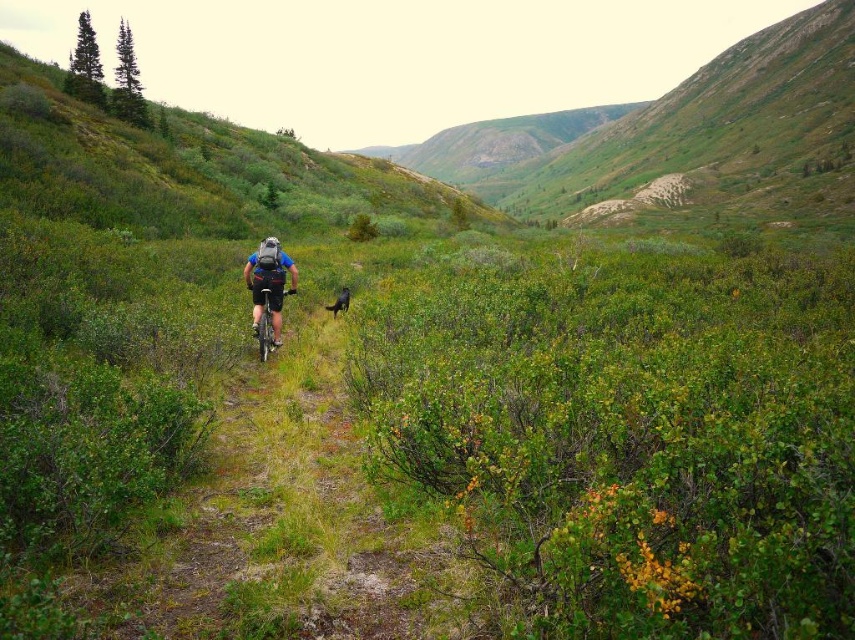
Is the position of blue matte bicycle at center more distant than that of shiny black dog at center?

That is False.

Who is more distant from viewer, (x=260, y=246) or (x=348, y=289)?

The point (x=348, y=289) is behind.

Where is `blue matte bicycle at center`? This screenshot has height=640, width=855. blue matte bicycle at center is located at coordinates (269, 282).

Does blue matte bicycle at center come behind shiny metallic bicycle at center?

No, blue matte bicycle at center is in front of shiny metallic bicycle at center.

Between blue matte bicycle at center and shiny metallic bicycle at center, which one is positioned higher?

blue matte bicycle at center is above.

You are a GUI agent. You are given a task and a screenshot of the screen. Output one action in this format:
    pyautogui.click(x=<x>, y=<y>)
    Task: Click on the blue matte bicycle at center
    This screenshot has width=855, height=640.
    Given the screenshot: What is the action you would take?
    (269, 282)

Can you confirm if shiny metallic bicycle at center is positioned to the right of shiny black dog at center?

In fact, shiny metallic bicycle at center is to the left of shiny black dog at center.

Who is more distant from viewer, (260,342) or (333,305)?

The point (333,305) is behind.

Which is behind, point (268, 323) or point (345, 285)?

Positioned behind is point (345, 285).

Image resolution: width=855 pixels, height=640 pixels. Find the location of `shiny metallic bicycle at center`. shiny metallic bicycle at center is located at coordinates (264, 326).